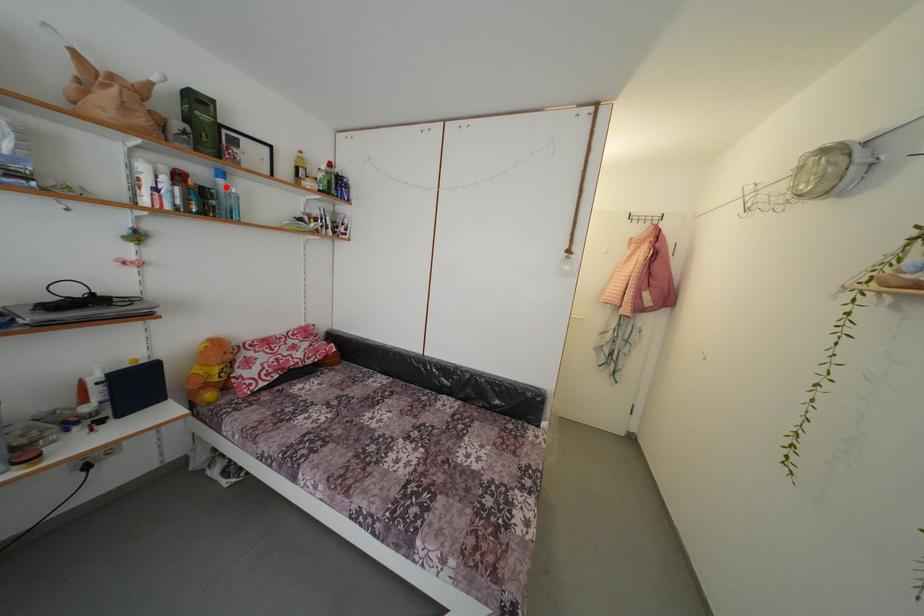
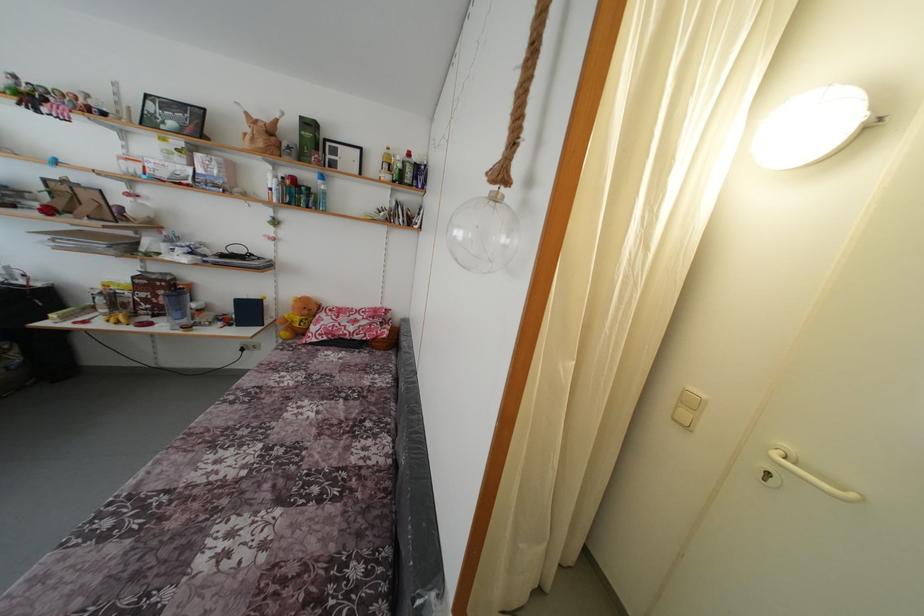
In the second image, find the point that corresponds to the highlighted location in the first image.

(324, 188)